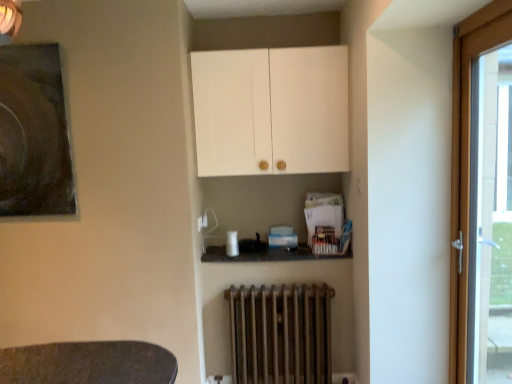
Question: Is dark matte painting at upper left situated inside rusty metal radiator at lower center or outside?

Choices:
 (A) outside
 (B) inside

Answer: (A)

Question: Would you say dark matte painting at upper left is to the left or to the right of rusty metal radiator at lower center in the picture?

Choices:
 (A) right
 (B) left

Answer: (B)

Question: Which object is the closest to the wooden door at right?

Choices:
 (A) white matte cabinet at upper center
 (B) rusty metal radiator at lower center
 (C) dark matte painting at upper left

Answer: (A)

Question: Estimate the real-world distances between objects in this image. Which object is closer to the dark matte painting at upper left?

Choices:
 (A) rusty metal radiator at lower center
 (B) wooden door at right
 (C) white matte cabinet at upper center

Answer: (C)